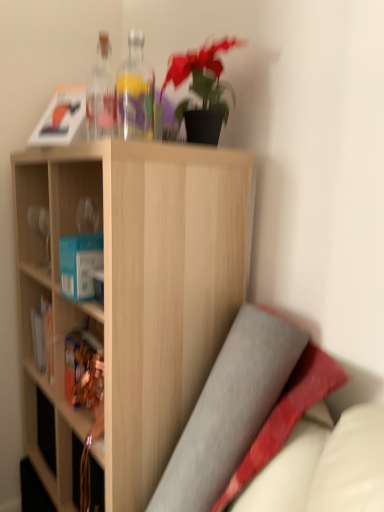
Question: Based on their positions, is transparent glass bottles at upper center, which is counted as the first bottle, starting from the left, located to the left or right of matte brown book at left?

Choices:
 (A) right
 (B) left

Answer: (A)

Question: Is transparent glass bottles at upper center, which is counted as the first bottle, starting from the left, spatially inside matte brown book at left, or outside of it?

Choices:
 (A) outside
 (B) inside

Answer: (A)

Question: Estimate the real-world distances between objects in this image. Which object is farther from the matte brown book at left?

Choices:
 (A) transparent glass bottles at upper center, which is counted as the first bottle, starting from the left
 (B) light wood shelf at center
 (C) transparent glass bottle at upper center, placed as the first bottle when sorted from right to left

Answer: (C)

Question: Considering the real-world distances, which object is closest to the light wood shelf at center?

Choices:
 (A) transparent glass bottles at upper center, which is counted as the first bottle, starting from the left
 (B) transparent glass bottle at upper center, positioned as the second bottle in left-to-right order
 (C) matte brown book at left

Answer: (C)